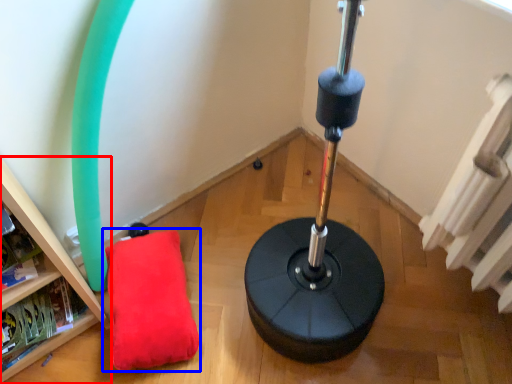
Question: Which object appears farthest to the camera in this image, furniture (highlighted by a red box) or pillow (highlighted by a blue box)?

Choices:
 (A) furniture
 (B) pillow

Answer: (B)